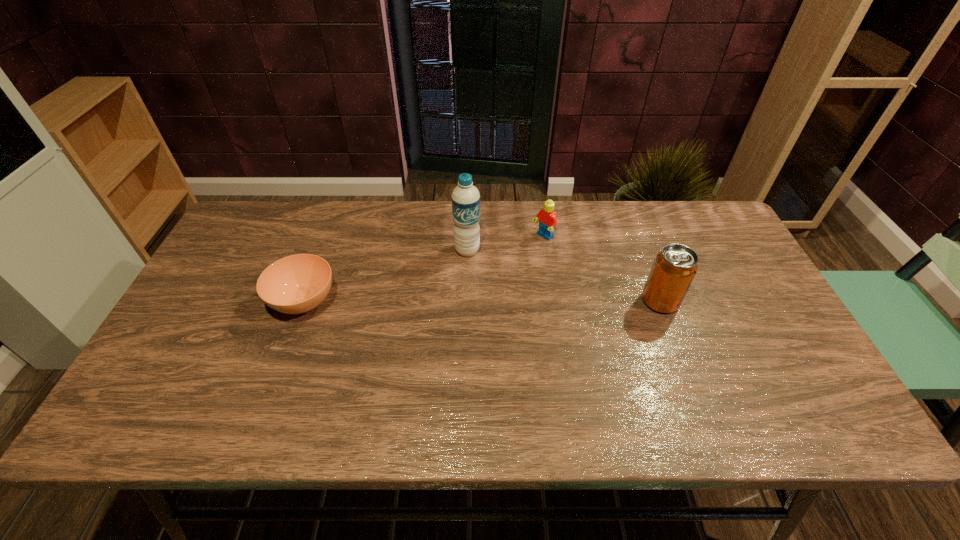
Find the location of a particular element. free space located 0.250m on the label of the second object from left to right is located at coordinates (454, 326).

Locate an element on the screen. vacant space located on the label of the second object from left to right is located at coordinates (464, 271).

Locate an element on the screen. Image resolution: width=960 pixels, height=540 pixels. free space located on the label of the second object from left to right is located at coordinates (448, 355).

Locate an element on the screen. The height and width of the screenshot is (540, 960). vacant space located 0.130m on the face of the third object from left to right is located at coordinates (507, 263).

The image size is (960, 540). In order to click on free location located on the face of the third object from left to right in this screenshot , I will do `click(488, 276)`.

You are a GUI agent. You are given a task and a screenshot of the screen. Output one action in this format:
    pyautogui.click(x=<x>, y=<y>)
    Task: Click on the vacant space situated on the face of the third object from left to right
    This screenshot has width=960, height=540.
    Given the screenshot: What is the action you would take?
    pyautogui.click(x=441, y=311)

Locate an element on the screen. water bottle that is positioned at the far edge is located at coordinates (465, 197).

At what (x,y) coordinates should I click in order to perform the action: click on Lego located in the far edge section of the desktop. Please return your answer as a coordinate pair (x, y). This screenshot has height=540, width=960. Looking at the image, I should click on [547, 218].

The width and height of the screenshot is (960, 540). Find the location of `free region at the far edge of the desktop`. free region at the far edge of the desktop is located at coordinates (381, 204).

This screenshot has height=540, width=960. Identify the location of vacant region at the near edge of the desktop. (714, 375).